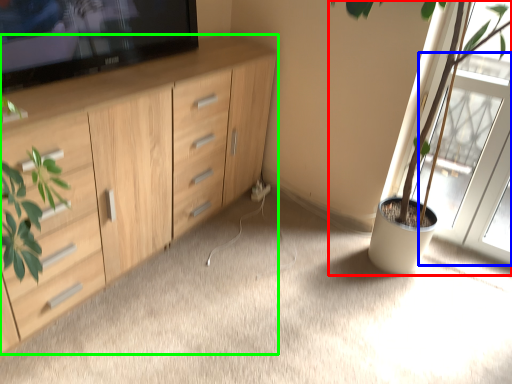
Question: Which object is the closest to the houseplant (highlighted by a red box)? Choose among these: screen door (highlighted by a blue box) or cabinetry (highlighted by a green box).

Choices:
 (A) screen door
 (B) cabinetry

Answer: (A)